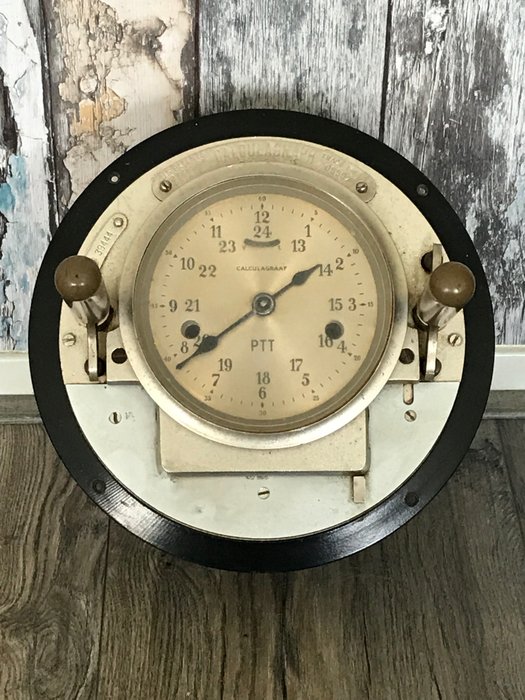
Where is `wall`? wall is located at coordinates (269, 29).